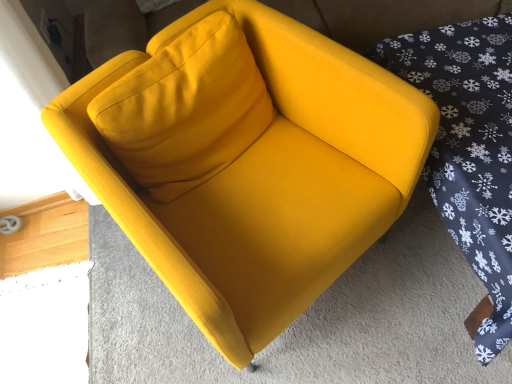
I want to click on dark blue snowflake-patterned fabric at right, so click(469, 148).

This screenshot has height=384, width=512. Describe the element at coordinates (469, 148) in the screenshot. I see `dark blue snowflake-patterned fabric at right` at that location.

What is the approximate width of dark blue snowflake-patterned fabric at right?

dark blue snowflake-patterned fabric at right is 1.09 meters in width.

Measure the distance between point (490, 328) and camera.

The depth of point (490, 328) is 3.31 feet.

Find the location of `dark blue snowflake-patterned fabric at right`. dark blue snowflake-patterned fabric at right is located at coordinates (469, 148).